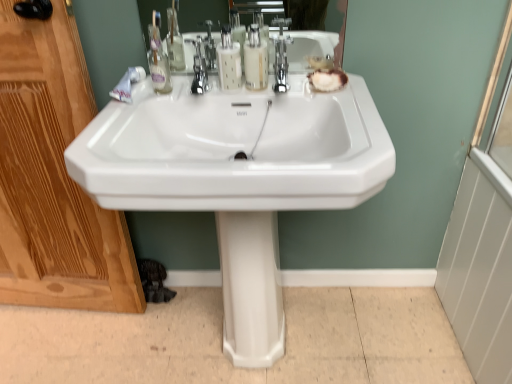
This screenshot has height=384, width=512. Find the location of `free space in front of wooden screen door at left`. free space in front of wooden screen door at left is located at coordinates click(x=55, y=352).